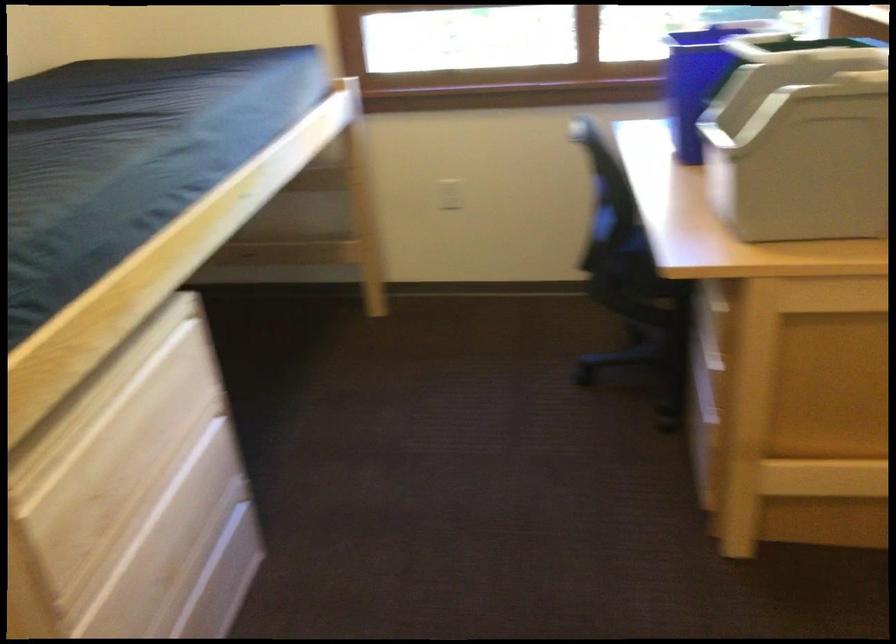
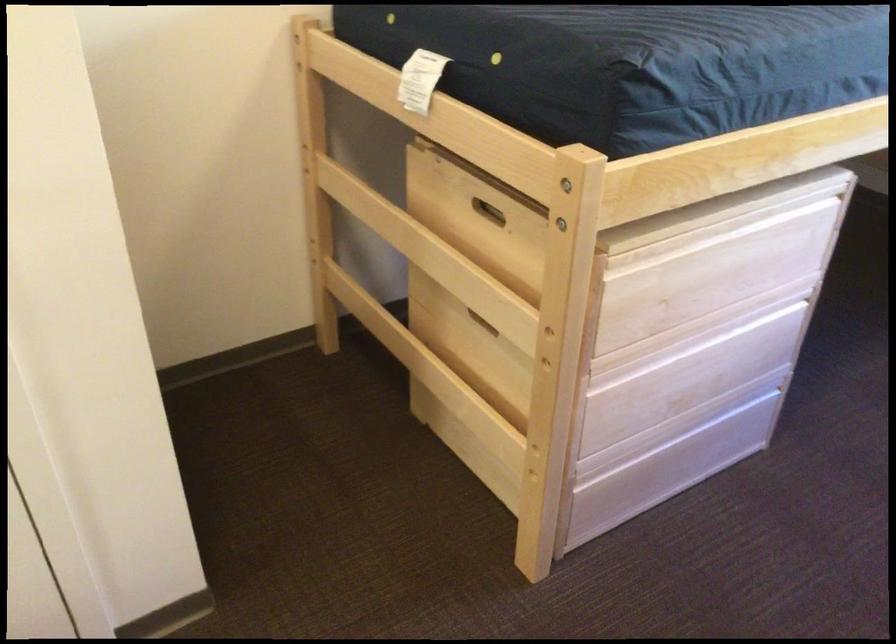
In the second image, find the point that corresponds to point 110,397 in the first image.

(720, 230)